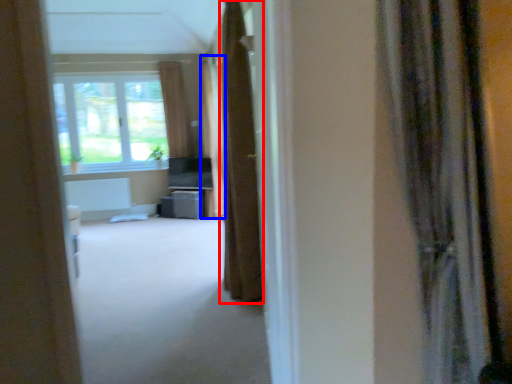
Question: Among these objects, which one is nearest to the camera, curtain (highlighted by a red box) or curtain (highlighted by a blue box)?

Choices:
 (A) curtain
 (B) curtain

Answer: (A)